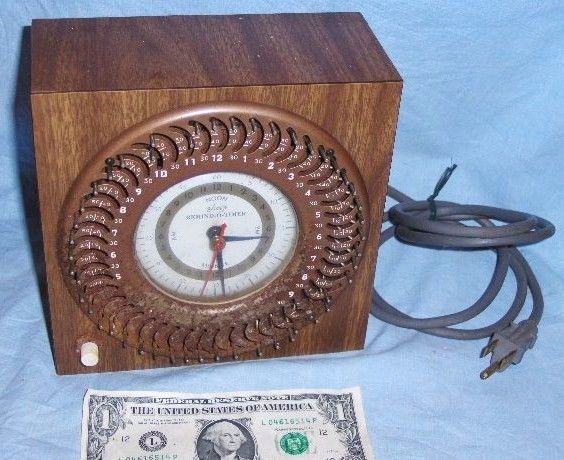
Identify the location of red clock arm. click(213, 254).